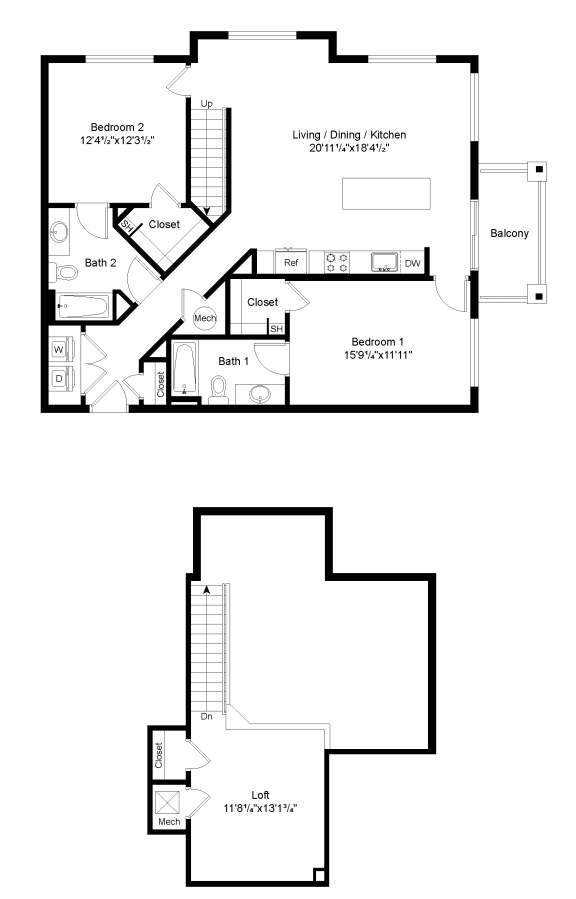
What are the coordinates of `stairs` in the screenshot? It's located at (199, 138), (204, 654).